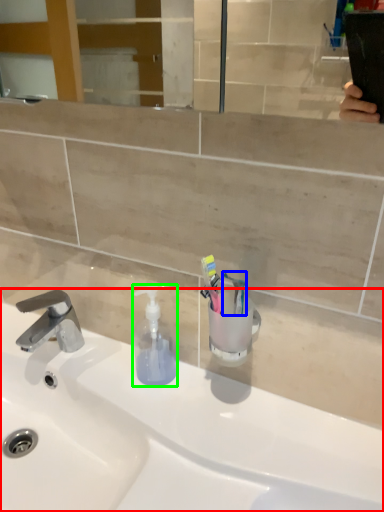
Question: Considering the real-world distances, which object is farthest from sink (highlighted by a red box)? toothbrush (highlighted by a blue box) or soap dispenser (highlighted by a green box)?

Choices:
 (A) toothbrush
 (B) soap dispenser

Answer: (A)